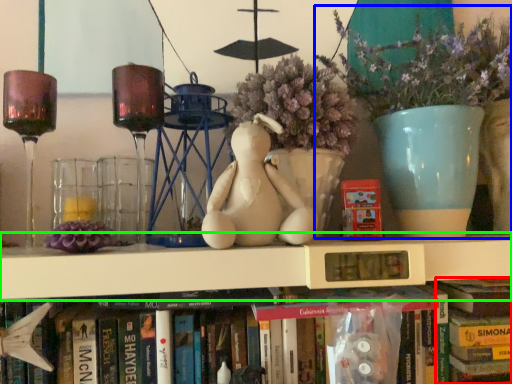
Question: Considering the real-world distances, which object is farthest from book (highlighted by a red box)? floral arrangement (highlighted by a blue box) or shelf (highlighted by a green box)?

Choices:
 (A) floral arrangement
 (B) shelf

Answer: (A)